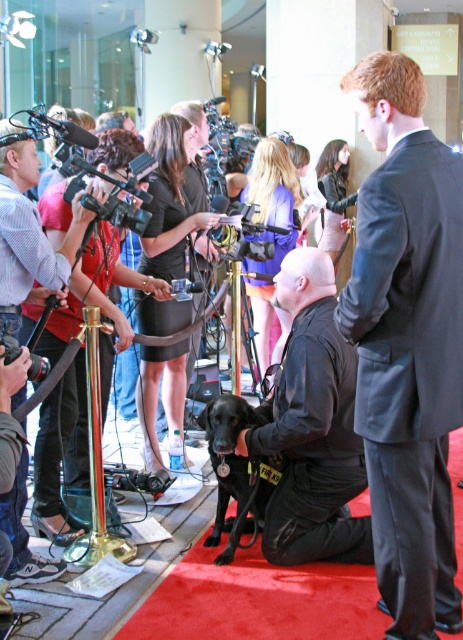
Who is higher up, black matte dog at center or black plastic video camera at center?

black plastic video camera at center is higher up.

Who is shorter, black matte dog at center or black plastic video camera at center?

black plastic video camera at center is shorter.

Is point (231, 426) in front of point (252, 237)?

Yes, it is in front of point (252, 237).

Identify the location of black matte dog at center. pyautogui.click(x=232, y=468).

Can you confirm if dark gray suit at center is positioned below black plastic video camera at center?

Indeed, dark gray suit at center is positioned under black plastic video camera at center.

Can you confirm if dark gray suit at center is positioned to the left of black plastic video camera at center?

No, dark gray suit at center is not to the left of black plastic video camera at center.

Which is in front, point (379, 339) or point (287, 234)?

Positioned in front is point (379, 339).

Locate an element on the screen. This screenshot has width=463, height=640. dark gray suit at center is located at coordinates (406, 342).

Is dark gray suit at center positioned before black leather jacket at center?

Yes, it is.

Between point (382, 369) and point (336, 412), which one is positioned in front?

Point (382, 369) is more forward.

Locate an element on the screen. dark gray suit at center is located at coordinates (406, 342).